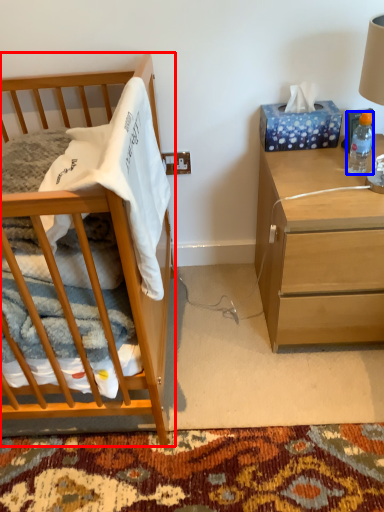
Question: Which of the following is the closest to the observer, cabinetry (highlighted by a red box) or bottle (highlighted by a blue box)?

Choices:
 (A) cabinetry
 (B) bottle

Answer: (A)